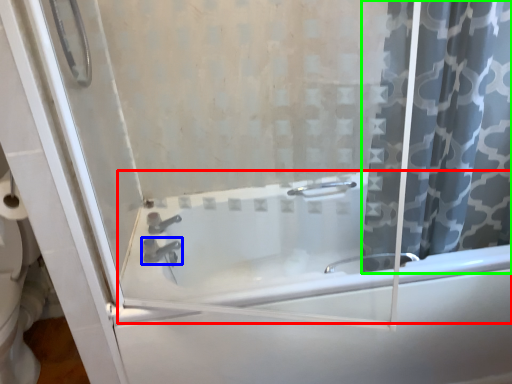
Question: Considering the real-world distances, which object is farthest from bathtub (highlighted by a red box)? tap (highlighted by a blue box) or curtain (highlighted by a green box)?

Choices:
 (A) tap
 (B) curtain

Answer: (A)